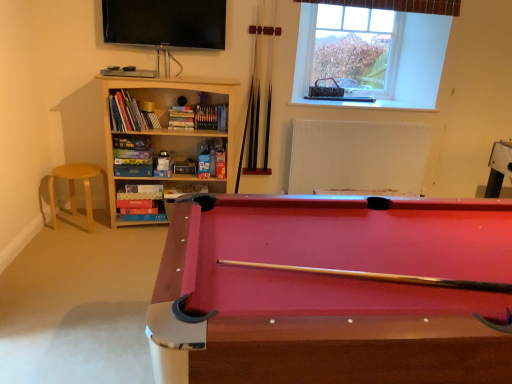
Question: Is white matte radiator at upper center surrounded by light wood stool at left?

Choices:
 (A) yes
 (B) no

Answer: (B)

Question: From the image's perspective, is light wood stool at left on white matte radiator at upper center?

Choices:
 (A) yes
 (B) no

Answer: (B)

Question: Is light wood stool at left located outside white matte radiator at upper center?

Choices:
 (A) yes
 (B) no

Answer: (A)

Question: Can you confirm if light wood stool at left is taller than white matte radiator at upper center?

Choices:
 (A) no
 (B) yes

Answer: (A)

Question: Is light wood stool at left oriented towards white matte radiator at upper center?

Choices:
 (A) no
 (B) yes

Answer: (A)

Question: Based on their sizes in the image, would you say clear glass window at upper center is bigger or smaller than white matte radiator at upper center?

Choices:
 (A) big
 (B) small

Answer: (B)

Question: Is clear glass window at upper center situated inside white matte radiator at upper center or outside?

Choices:
 (A) outside
 (B) inside

Answer: (A)

Question: Is point pyautogui.click(x=376, y=31) positioned closer to the camera than point pyautogui.click(x=388, y=125)?

Choices:
 (A) closer
 (B) farther

Answer: (B)

Question: Relative to white matte radiator at upper center, is clear glass window at upper center in front or behind?

Choices:
 (A) behind
 (B) front

Answer: (A)

Question: Looking at their shapes, would you say clear glass window at upper center is wider or thinner than flat screen tv at upper center?

Choices:
 (A) thin
 (B) wide

Answer: (B)

Question: Based on their positions, is clear glass window at upper center located to the left or right of flat screen tv at upper center?

Choices:
 (A) left
 (B) right

Answer: (B)

Question: Considering the positions of clear glass window at upper center and flat screen tv at upper center in the image, is clear glass window at upper center taller or shorter than flat screen tv at upper center?

Choices:
 (A) short
 (B) tall

Answer: (B)

Question: From the image's perspective, relative to flat screen tv at upper center, is clear glass window at upper center above or below?

Choices:
 (A) above
 (B) below

Answer: (A)

Question: Is white matte radiator at upper center in front of or behind wooden bookcase at left in the image?

Choices:
 (A) behind
 (B) front

Answer: (A)

Question: Is white matte radiator at upper center taller or shorter than wooden bookcase at left?

Choices:
 (A) tall
 (B) short

Answer: (B)